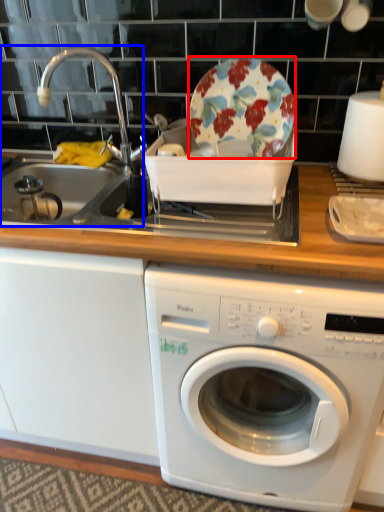
Question: Among these objects, which one is nearest to the camera, plate (highlighted by a red box) or sink (highlighted by a blue box)?

Choices:
 (A) plate
 (B) sink

Answer: (A)